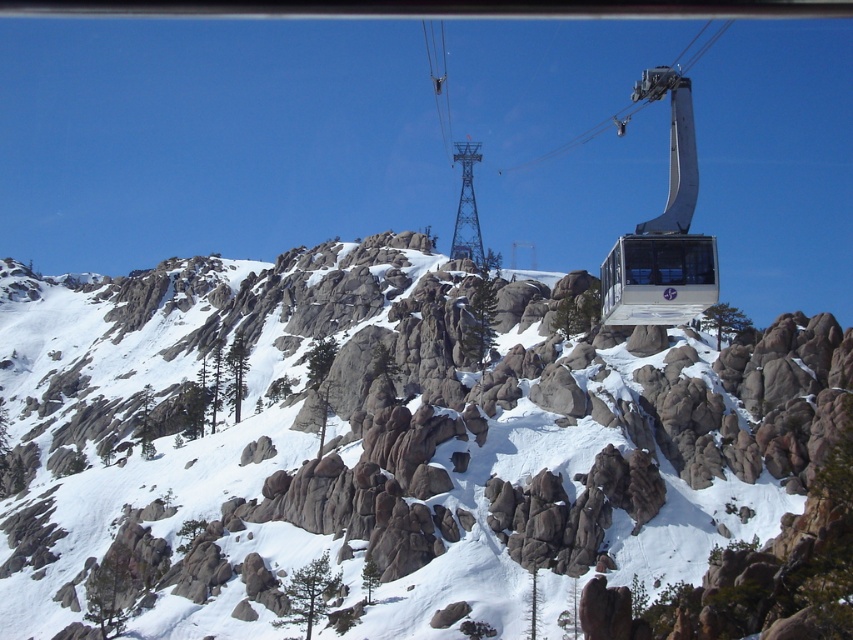
You are a hiker planning to take a photo of the metallic silver gondola at center from the snowy granite mountain at center. Can you see the gondola from your position on the mountain?

The snowy granite mountain at center is below the metallic silver gondola at center, so yes, you can see the gondola from the mountain as it is positioned above you.

You are planning to take a photo of the snowy granite mountain at center and the metallic silver gondola at center. Which object should you focus on first if you want to capture both in the same frame without moving the camera?

The snowy granite mountain at center is wider than the metallic silver gondola at center, so you should focus on the snowy granite mountain at center first to ensure it fits entirely in the frame before adjusting for the gondola.